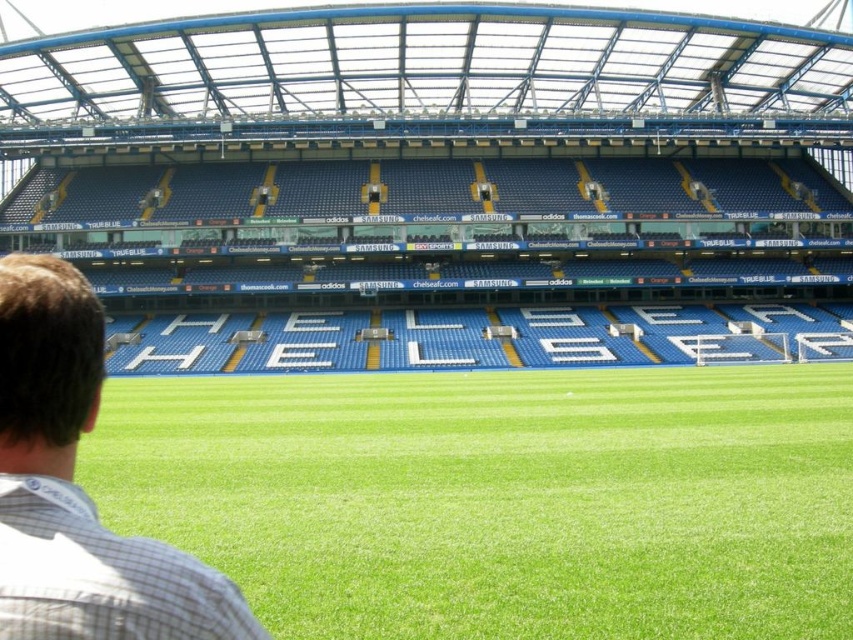
Is green grass at center positioned in front of brown checkered shirt at lower left?

No, it is behind brown checkered shirt at lower left.

Does green grass at center appear over brown checkered shirt at lower left?

No.

Is point (107, 435) positioned after point (227, 589)?

That is True.

At what (x,y) coordinates should I click in order to perform the action: click on green grass at center. Please return your answer as a coordinate pair (x, y). Looking at the image, I should click on (498, 497).